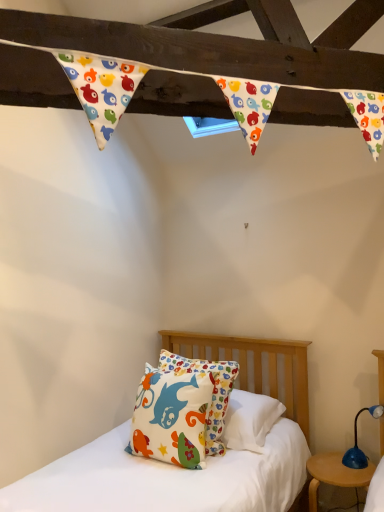
Find the location of `blue plastic table lamp at lower right`. blue plastic table lamp at lower right is located at coordinates (357, 443).

The height and width of the screenshot is (512, 384). What are the coordinates of `wooden round table at lower right` in the screenshot? It's located at (335, 475).

Is point (368, 461) positioned after point (210, 385)?

Yes, it is.

Image resolution: width=384 pixels, height=512 pixels. In the image, there is a matte cotton pillow at center. What are the coordinates of `nightstand below it (from the image's perspective)` in the screenshot? It's located at (335, 475).

Considering their positions, is wooden round table at lower right located in front of or behind matte cotton pillow at center?

In the image, wooden round table at lower right appears behind matte cotton pillow at center.

From the image's perspective, is matte cotton pillow at center on blue plastic table lamp at lower right?

Correct, matte cotton pillow at center appears higher than blue plastic table lamp at lower right in the image.

Is matte cotton pillow at center in front of or behind blue plastic table lamp at lower right in the image?

Clearly, matte cotton pillow at center is in front of blue plastic table lamp at lower right.

Is there a large distance between matte cotton pillow at center and blue plastic table lamp at lower right?

No, matte cotton pillow at center is in close proximity to blue plastic table lamp at lower right.

Considering the sizes of matte cotton pillow at center and blue plastic table lamp at lower right in the image, is matte cotton pillow at center taller or shorter than blue plastic table lamp at lower right?

Clearly, matte cotton pillow at center is taller compared to blue plastic table lamp at lower right.

Can you confirm if blue plastic table lamp at lower right is taller than matte cotton pillow at center?

No.

Consider the image. In the image, is blue plastic table lamp at lower right positioned in front of or behind matte cotton pillow at center?

Visually, blue plastic table lamp at lower right is located behind matte cotton pillow at center.

Would you say blue plastic table lamp at lower right is to the left or to the right of matte cotton pillow at center in the picture?

blue plastic table lamp at lower right is positioned on matte cotton pillow at center's right side.

At what (x,y) coordinates should I click in order to perform the action: click on nightstand below the matte cotton pillow at center (from the image's perspective). Please return your answer as a coordinate pair (x, y). Image resolution: width=384 pixels, height=512 pixels. Looking at the image, I should click on [335, 475].

Would you say matte cotton pillow at center contains wooden round table at lower right?

Actually, wooden round table at lower right is outside matte cotton pillow at center.

Which is in front, matte cotton pillow at center or wooden round table at lower right?

matte cotton pillow at center is more forward.

Is matte cotton pillow at center in contact with wooden round table at lower right?

No, matte cotton pillow at center is not in contact with wooden round table at lower right.

Considering the points (315, 497) and (355, 437), which point is behind, point (315, 497) or point (355, 437)?

Point (355, 437)

This screenshot has height=512, width=384. I want to click on table lamp above the wooden round table at lower right (from a real-world perspective), so click(x=357, y=443).

From the image's perspective, is blue plastic table lamp at lower right located above wooden round table at lower right?

Yes.

From a real-world perspective, is blue plastic table lamp at lower right above or below wooden round table at lower right?

In terms of real-world spatial position, blue plastic table lamp at lower right is above wooden round table at lower right.

Is blue plastic table lamp at lower right with wooden round table at lower right?

No, blue plastic table lamp at lower right is not beside wooden round table at lower right.

Does blue plastic table lamp at lower right have a lesser width compared to wooden round table at lower right?

Yes.

What are the coordinates of `nightstand located behind the matte cotton pillow at center` in the screenshot? It's located at (335, 475).

What are the coordinates of `table lamp that appears on the right of matte cotton pillow at center` in the screenshot? It's located at (357, 443).

Estimate the real-world distances between objects in this image. Which object is closer to matte cotton pillow at center, wooden round table at lower right or blue plastic table lamp at lower right?

wooden round table at lower right.

Which object lies further to the anchor point blue plastic table lamp at lower right, wooden round table at lower right or matte cotton pillow at center?

The object further to blue plastic table lamp at lower right is matte cotton pillow at center.

Estimate the real-world distances between objects in this image. Which object is closer to wooden round table at lower right, blue plastic table lamp at lower right or matte cotton pillow at center?

blue plastic table lamp at lower right is positioned closer to the anchor wooden round table at lower right.

Based on their spatial positions, is matte cotton pillow at center or wooden round table at lower right further from blue plastic table lamp at lower right?

matte cotton pillow at center is positioned further to the anchor blue plastic table lamp at lower right.

Based on their spatial positions, is matte cotton pillow at center or blue plastic table lamp at lower right further from wooden round table at lower right?

The object further to wooden round table at lower right is matte cotton pillow at center.

When comparing their distances from matte cotton pillow at center, does blue plastic table lamp at lower right or wooden round table at lower right seem further?

blue plastic table lamp at lower right is positioned further to the anchor matte cotton pillow at center.

This screenshot has width=384, height=512. I want to click on nightstand located between matte cotton pillow at center and blue plastic table lamp at lower right in the left-right direction, so click(335, 475).